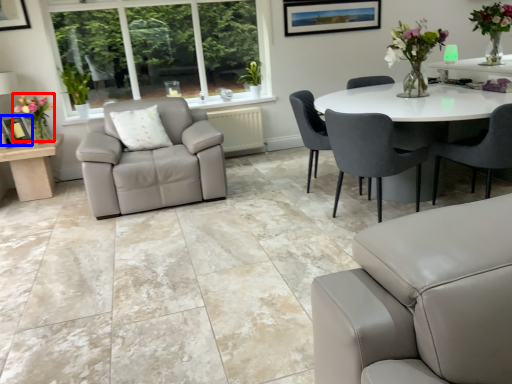
Question: Which of the following is the farthest to the observer, floral arrangement (highlighted by a red box) or picture frame (highlighted by a blue box)?

Choices:
 (A) floral arrangement
 (B) picture frame

Answer: (B)